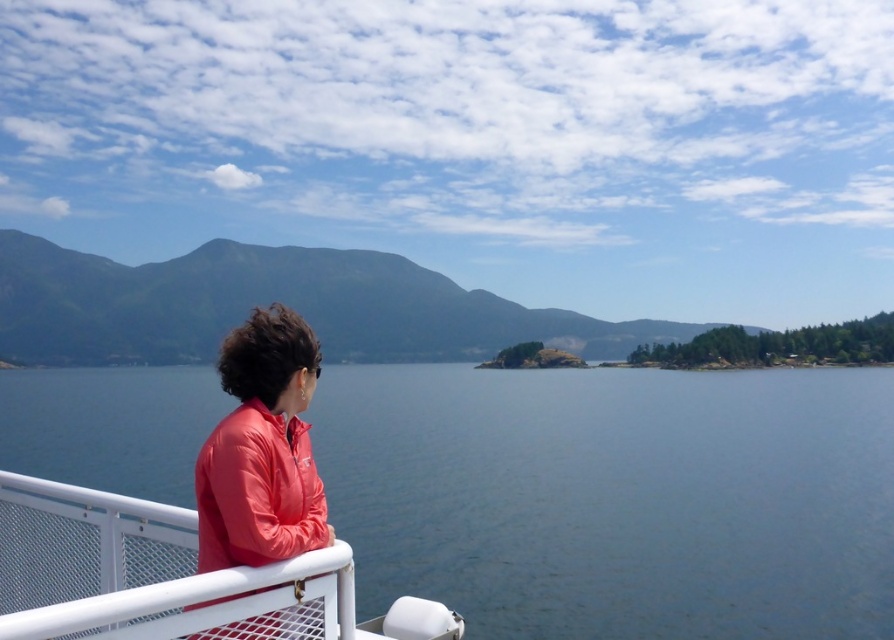
Question: Can you confirm if blue water at center is bigger than matte red jacket at lower left?

Choices:
 (A) no
 (B) yes

Answer: (B)

Question: Which of the following is the farthest from the observer?

Choices:
 (A) green matte mountain at upper left
 (B) matte red jacket at lower left
 (C) blue water at center
 (D) matte red jacket at left

Answer: (A)

Question: Does blue water at center appear under matte red jacket at left?

Choices:
 (A) no
 (B) yes

Answer: (B)

Question: Among these objects, which one is farthest from the camera?

Choices:
 (A) matte red jacket at left
 (B) blue water at center
 (C) matte red jacket at lower left

Answer: (B)

Question: Is green matte mountain at upper left wider than matte red jacket at lower left?

Choices:
 (A) no
 (B) yes

Answer: (B)

Question: Which point is farther to the camera?

Choices:
 (A) (249, 355)
 (B) (779, 403)
 (C) (70, 337)
 (D) (79, 529)

Answer: (C)